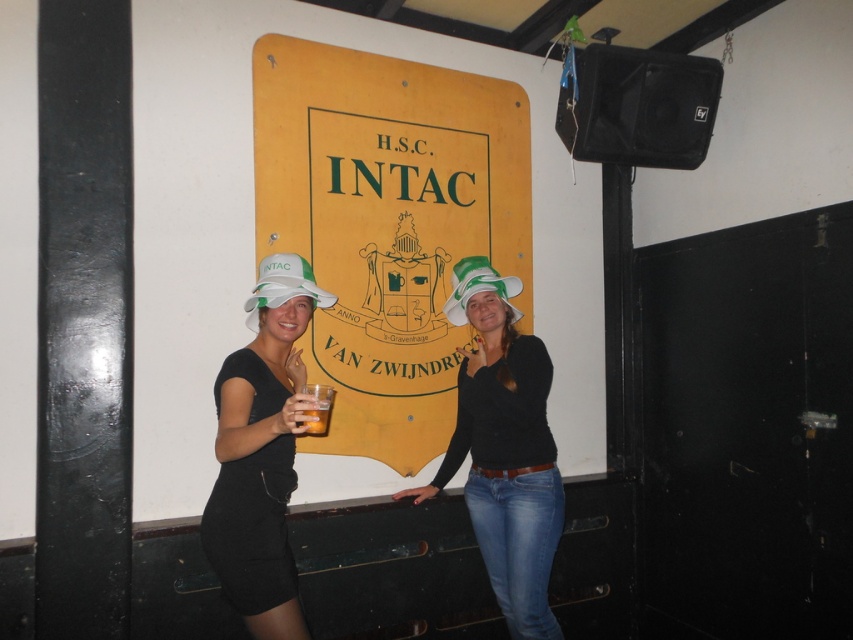
Does point (468, 262) come behind point (317, 413)?

Yes, it is behind point (317, 413).

Is point (460, 304) closer to viewer compared to point (310, 422)?

No, it is not.

Is point (476, 268) positioned before point (328, 404)?

No, (476, 268) is further to viewer.

Locate an element on the screen. green fabric hat at center is located at coordinates (479, 288).

Who is positioned more to the left, matte white hat at center or white fabric hat at left?

white fabric hat at left

What do you see at coordinates (503, 449) in the screenshot?
I see `matte white hat at center` at bounding box center [503, 449].

Identify the location of matte white hat at center. 503,449.

Which is more to the left, white fabric hat at upper center or white fabric hat at left?

white fabric hat at left is more to the left.

Is point (318, 304) less distant than point (291, 272)?

No, (318, 304) is behind (291, 272).

At what (x,y) coordinates should I click in order to perform the action: click on white fabric hat at upper center. Please return your answer as a coordinate pair (x, y). Image resolution: width=853 pixels, height=640 pixels. Looking at the image, I should click on (260, 451).